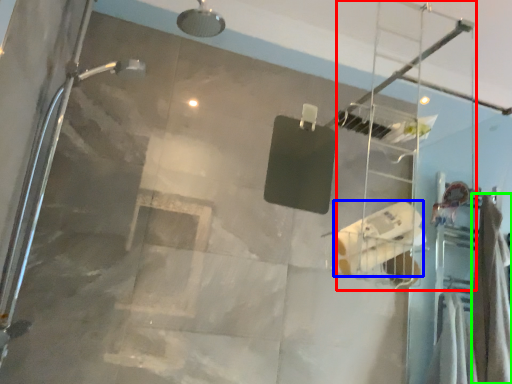
Question: Estimate the real-world distances between objects in this image. Which object is closer to ladder (highlighted by a red box), toilet paper (highlighted by a blue box) or shower curtain (highlighted by a green box)?

Choices:
 (A) toilet paper
 (B) shower curtain

Answer: (B)